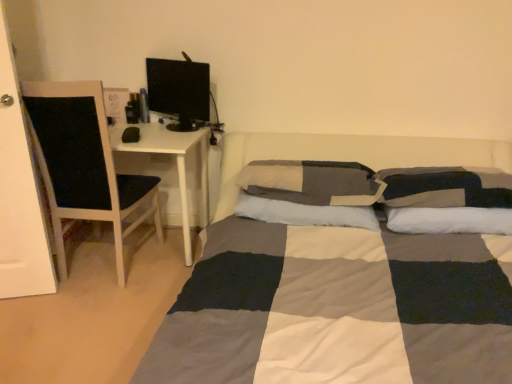
Locate an element on the screen. The image size is (512, 384). vacant area in front of white wood chair at left is located at coordinates (94, 304).